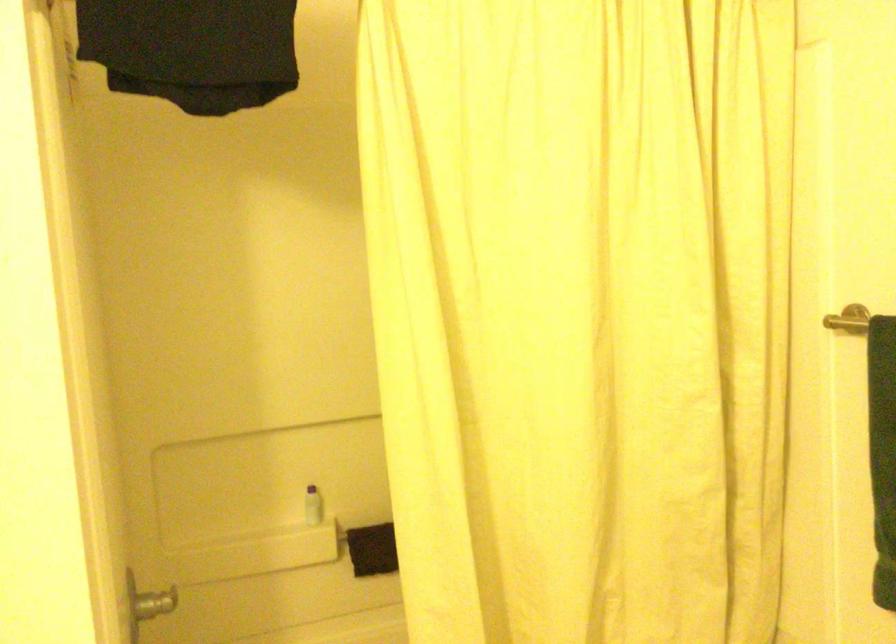
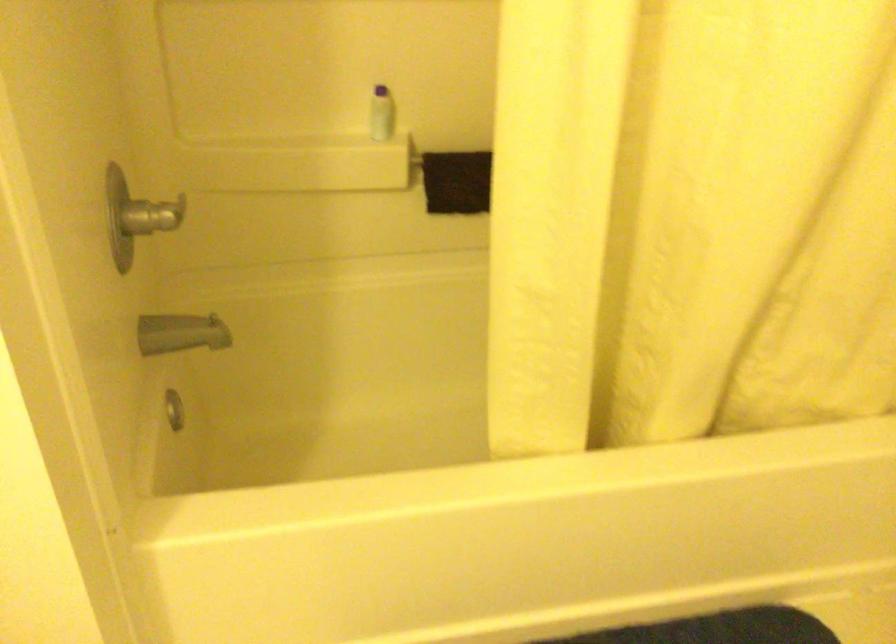
Find the pixel in the second image that matches the point at 313,507 in the first image.

(382, 114)